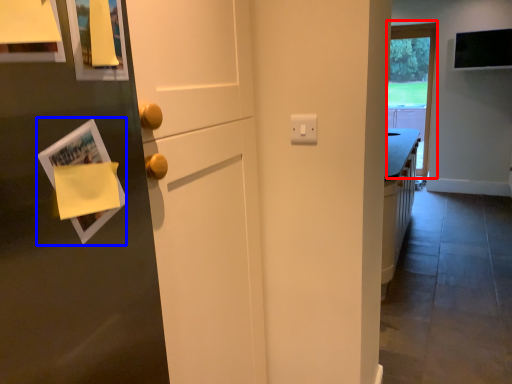
Question: Which point is further to the camera, window (highlighted by a red box) or magazine (highlighted by a blue box)?

Choices:
 (A) window
 (B) magazine

Answer: (A)